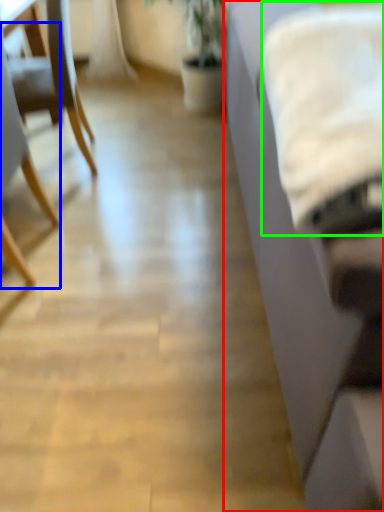
Question: Based on their relative distances, which object is farther from studio couch (highlighted by a red box)? Choose from chair (highlighted by a blue box) and sheet (highlighted by a green box).

Choices:
 (A) chair
 (B) sheet

Answer: (A)